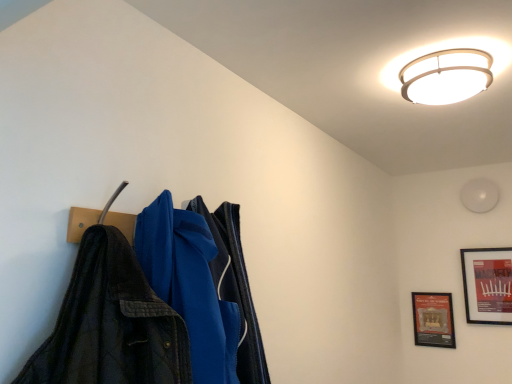
Question: Is white glossy ceiling light at upper center outside of matte black picture frame at upper right, which is the first picture frame from right to left?

Choices:
 (A) no
 (B) yes

Answer: (B)

Question: Is white glossy ceiling light at upper center closer to camera compared to matte black picture frame at upper right, which is the first picture frame from right to left?

Choices:
 (A) no
 (B) yes

Answer: (B)

Question: Considering the relative sizes of white glossy ceiling light at upper center and matte black picture frame at upper right, positioned as the 2th picture frame in left-to-right order, in the image provided, is white glossy ceiling light at upper center thinner than matte black picture frame at upper right, positioned as the 2th picture frame in left-to-right order,?

Choices:
 (A) no
 (B) yes

Answer: (A)

Question: Considering the relative sizes of white glossy ceiling light at upper center and matte black picture frame at upper right, positioned as the 2th picture frame in left-to-right order, in the image provided, is white glossy ceiling light at upper center shorter than matte black picture frame at upper right, positioned as the 2th picture frame in left-to-right order,?

Choices:
 (A) no
 (B) yes

Answer: (B)

Question: From a real-world perspective, is white glossy ceiling light at upper center beneath matte black picture frame at upper right, positioned as the 2th picture frame in left-to-right order?

Choices:
 (A) no
 (B) yes

Answer: (A)

Question: Looking at their shapes, would you say white glossy ceiling light at upper center is wider or thinner than matte black picture frame at upper right, which is the first picture frame from right to left?

Choices:
 (A) wide
 (B) thin

Answer: (A)

Question: Is white glossy ceiling light at upper center bigger or smaller than matte black picture frame at upper right, positioned as the 2th picture frame in left-to-right order?

Choices:
 (A) small
 (B) big

Answer: (B)

Question: Is point (471, 61) closer or farther from the camera than point (477, 301)?

Choices:
 (A) closer
 (B) farther

Answer: (A)

Question: Considering the relative positions of white glossy ceiling light at upper center and matte black picture frame at upper right, which is the first picture frame from right to left, in the image provided, is white glossy ceiling light at upper center to the left or to the right of matte black picture frame at upper right, which is the first picture frame from right to left,?

Choices:
 (A) left
 (B) right

Answer: (A)

Question: Based on their sizes in the image, would you say white glossy ceiling light at upper center is bigger or smaller than white matte light fixture at upper right?

Choices:
 (A) big
 (B) small

Answer: (A)

Question: From the image's perspective, is white glossy ceiling light at upper center above or below white matte light fixture at upper right?

Choices:
 (A) below
 (B) above

Answer: (B)

Question: In the image, is white glossy ceiling light at upper center positioned in front of or behind white matte light fixture at upper right?

Choices:
 (A) behind
 (B) front

Answer: (B)

Question: From their relative heights in the image, would you say white glossy ceiling light at upper center is taller or shorter than white matte light fixture at upper right?

Choices:
 (A) short
 (B) tall

Answer: (A)

Question: From a real-world perspective, is wooden framed poster at lower right, which appears as the 1th picture frame when viewed from the left, above or below matte black picture frame at upper right, which is the first picture frame from right to left?

Choices:
 (A) below
 (B) above

Answer: (A)

Question: In terms of height, does wooden framed poster at lower right, which appears as the 1th picture frame when viewed from the left, look taller or shorter compared to matte black picture frame at upper right, which is the first picture frame from right to left?

Choices:
 (A) tall
 (B) short

Answer: (B)